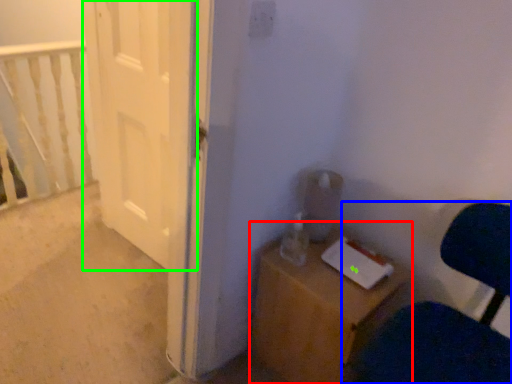
Question: Based on their relative distances, which object is nearer to furniture (highlighted by a red box)? Choose from chair (highlighted by a blue box) and door (highlighted by a green box).

Choices:
 (A) chair
 (B) door

Answer: (A)